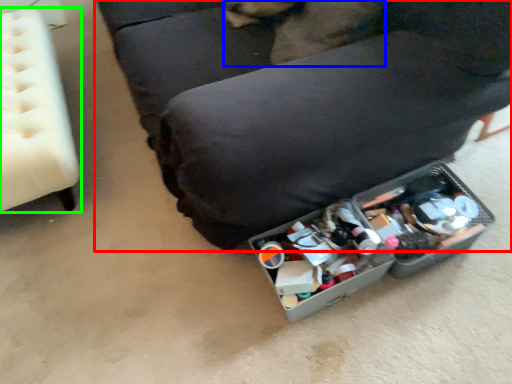
Question: Which object is positioned closest to furniture (highlighted by a red box)? Select from animal (highlighted by a blue box) and furniture (highlighted by a green box).

Choices:
 (A) animal
 (B) furniture

Answer: (A)